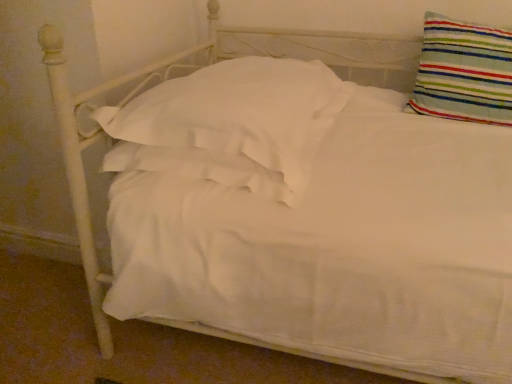
Question: Do you think striped fabric pillow at upper right, the first pillow viewed from the right, is within white soft pillow at center, marked as the 2th pillow in a right-to-left arrangement, or outside of it?

Choices:
 (A) inside
 (B) outside

Answer: (B)

Question: Relative to white soft pillow at center, the 1th pillow when ordered from left to right, is striped fabric pillow at upper right, the first pillow viewed from the right, in front or behind?

Choices:
 (A) behind
 (B) front

Answer: (A)

Question: Considering the relative positions of striped fabric pillow at upper right, acting as the 2th pillow starting from the left, and white soft pillow at center, marked as the 2th pillow in a right-to-left arrangement, in the image provided, is striped fabric pillow at upper right, acting as the 2th pillow starting from the left, to the left or to the right of white soft pillow at center, marked as the 2th pillow in a right-to-left arrangement,?

Choices:
 (A) right
 (B) left

Answer: (A)

Question: From the image's perspective, is white soft pillow at center, the 1th pillow when ordered from left to right, located above or below striped fabric pillow at upper right, the first pillow viewed from the right?

Choices:
 (A) below
 (B) above

Answer: (A)

Question: Considering their positions, is white soft pillow at center, the 1th pillow when ordered from left to right, located in front of or behind striped fabric pillow at upper right, the first pillow viewed from the right?

Choices:
 (A) behind
 (B) front

Answer: (B)

Question: Is white soft pillow at center, the 1th pillow when ordered from left to right, inside the boundaries of striped fabric pillow at upper right, acting as the 2th pillow starting from the left, or outside?

Choices:
 (A) inside
 (B) outside

Answer: (B)

Question: Visually, is white soft pillow at center, the 1th pillow when ordered from left to right, positioned to the left or to the right of striped fabric pillow at upper right, the first pillow viewed from the right?

Choices:
 (A) left
 (B) right

Answer: (A)